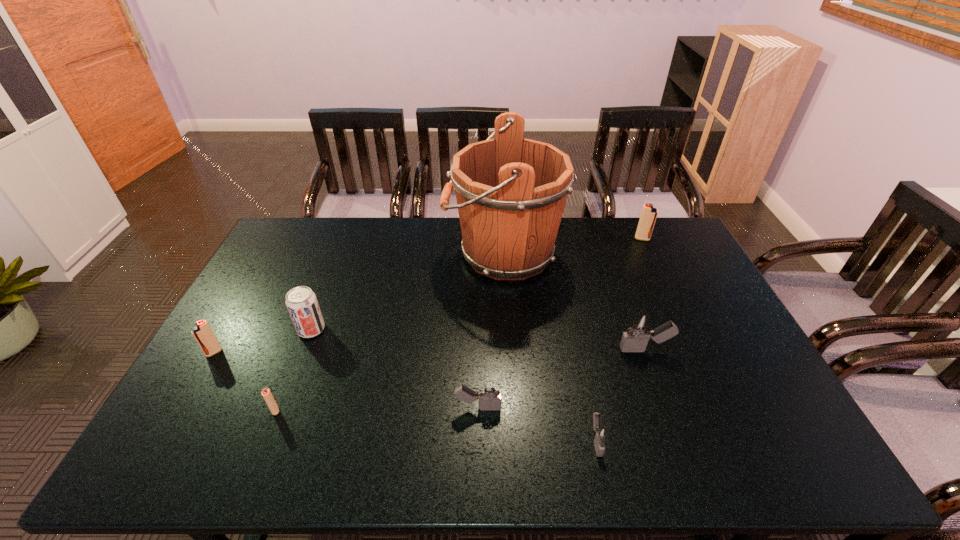
The image size is (960, 540). Find the location of `empty location between the bucket and the soda can`. empty location between the bucket and the soda can is located at coordinates (407, 291).

At what (x,y) coordinates should I click in order to perform the action: click on free spot between the farthest red igniter and the smallest gray igniter. Please return your answer as a coordinate pair (x, y). The width and height of the screenshot is (960, 540). Looking at the image, I should click on (619, 340).

Where is `vacant area between the tallest object and the soda can`? vacant area between the tallest object and the soda can is located at coordinates (407, 291).

I want to click on vacant area between the leftmost gray igniter and the leftmost object, so click(346, 380).

Where is `free space that is in between the biggest gray igniter and the nearest red igniter`? The height and width of the screenshot is (540, 960). free space that is in between the biggest gray igniter and the nearest red igniter is located at coordinates [x=460, y=380].

You are a GUI agent. You are given a task and a screenshot of the screen. Output one action in this format:
    pyautogui.click(x=<x>, y=<y>)
    Task: Click on the free point between the soda can and the rightmost gray igniter
    
    Given the screenshot: What is the action you would take?
    pyautogui.click(x=478, y=340)

Locate which object is the third closest to the leftmost object. Please provide its 2D coordinates. Your answer should be formatted as a tuple, i.e. [(x, y)], where the tuple contains the x and y coordinates of a point satisfying the conditions above.

[(511, 191)]

The image size is (960, 540). In order to click on object that ranks as the second closest to the bucket in this screenshot , I will do `click(649, 214)`.

Where is `the second closest igniter to the soda can`? This screenshot has height=540, width=960. the second closest igniter to the soda can is located at coordinates (266, 393).

Identify the location of igniter that can be found as the closest to the leftmost gray igniter. This screenshot has width=960, height=540. (600, 434).